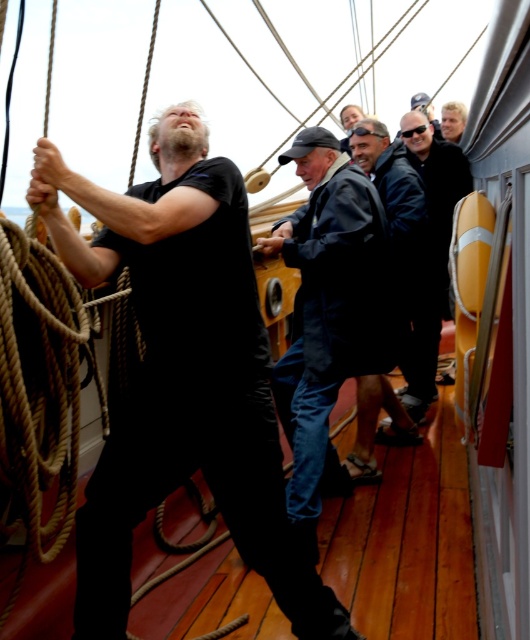
You are on the deck of a ship and see two dark blue jackets. One is labeled as dark blue jacket at center and the other as dark blue jacket at right. Which one is positioned more to the left?

The dark blue jacket at center is positioned more to the left compared to the dark blue jacket at right.

Where is the dark blue jacket at center located in the image?

The dark blue jacket at center is located at point coordinates of 0.487 on the x axis and 0.619 on the y axis.

You are a sailor on the deck of the ship and need to quickly identify which item is taller between the dark blue jacket at center and the dark blue denim shorts at center. Which one should you point out?

The dark blue jacket at center is taller than the dark blue denim shorts at center, so you should point out the dark blue jacket at center.